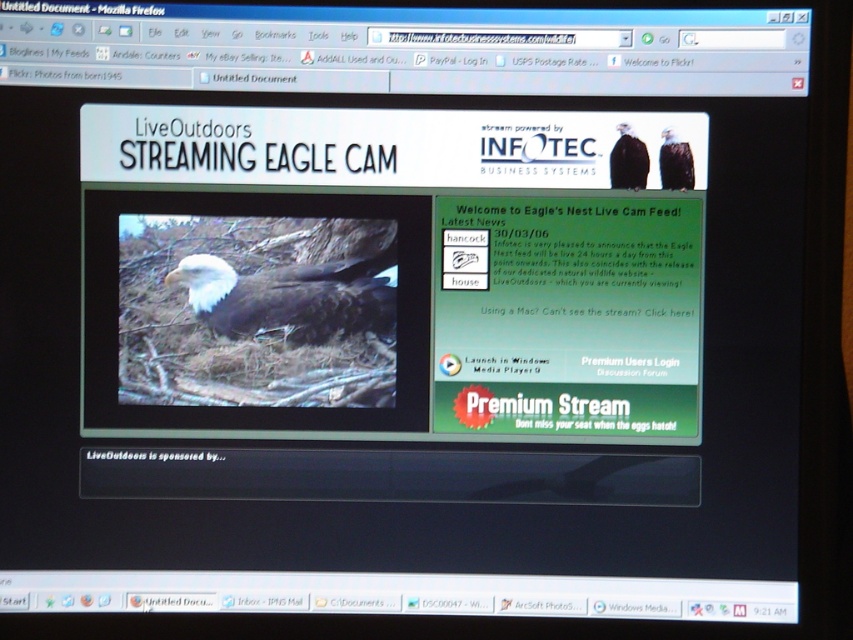
Question: Which object is closer to the camera taking this photo?

Choices:
 (A) dark brown feathers at upper right
 (B) matte black eagle at upper right
 (C) white feathered eagle at center

Answer: (A)

Question: Is white feathered eagle at center thinner than dark brown feathers at upper right?

Choices:
 (A) no
 (B) yes

Answer: (A)

Question: Considering the relative positions of white feathered eagle at center and dark brown feathers at upper right in the image provided, where is white feathered eagle at center located with respect to dark brown feathers at upper right?

Choices:
 (A) below
 (B) above

Answer: (A)

Question: Among these points, which one is nearest to the camera?

Choices:
 (A) (310, 266)
 (B) (642, 164)

Answer: (B)

Question: Estimate the real-world distances between objects in this image. Which object is farther from the white feathered eagle at center?

Choices:
 (A) matte black eagle at upper right
 (B) dark brown feathers at upper right

Answer: (B)

Question: Is white feathered eagle at center thinner than dark brown feathers at upper right?

Choices:
 (A) yes
 (B) no

Answer: (B)